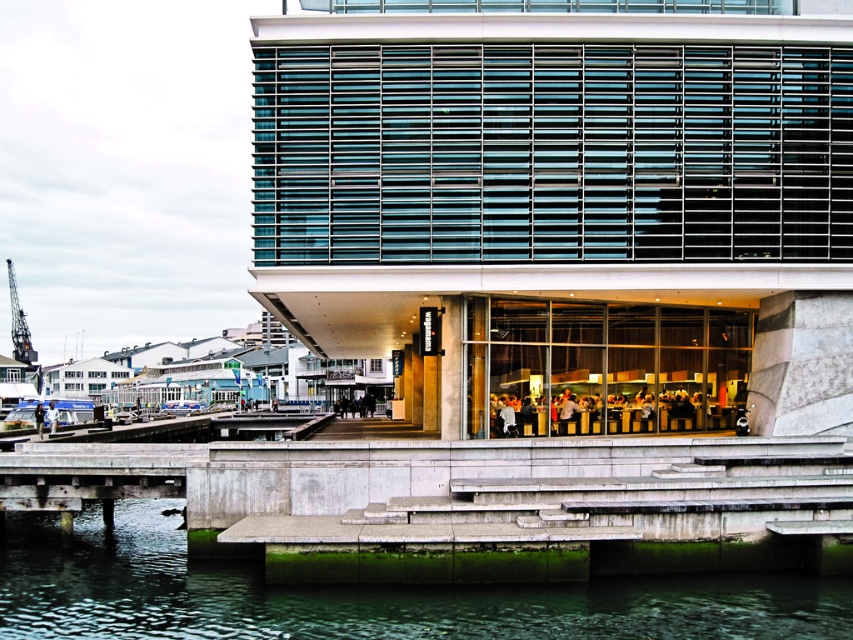
You are an architect evaluating the visibility of the matte black sign at center from the waterfront. Considering the presence of the matte black people at center, would the sign be obscured or still visible?

The matte black people at center are not as tall as the matte black sign at center, so the sign would still be visible from the waterfront despite the people being present.